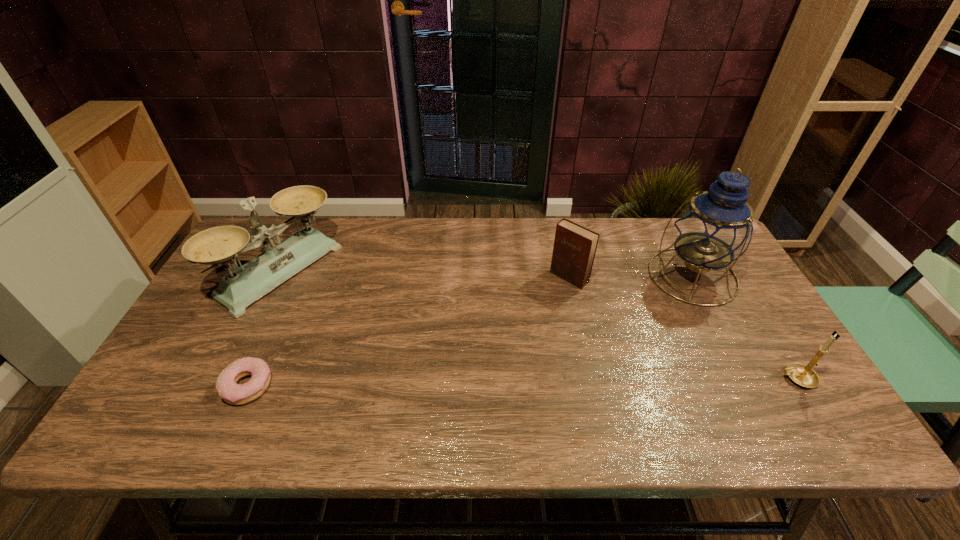
This screenshot has width=960, height=540. What are the coordinates of `doughnut` in the screenshot? It's located at (226, 385).

Identify the location of candle holder. The height and width of the screenshot is (540, 960). (803, 375).

The image size is (960, 540). Identify the location of diary. (574, 249).

You are a GUI agent. You are given a task and a screenshot of the screen. Output one action in this format:
    pyautogui.click(x=<x>, y=<y>)
    Task: Click on the tallest object
    The image size is (960, 540).
    Given the screenshot: What is the action you would take?
    pyautogui.click(x=716, y=227)

At what (x,y) coordinates should I click in order to perform the action: click on scale. Please return your answer as a coordinate pair (x, y). Looking at the image, I should click on (237, 290).

Find the location of a particular element. vacant space located on the back of the doughnut is located at coordinates (290, 288).

Find the location of a particular element. This screenshot has height=540, width=960. vacant space located on the handle side of the candle holder is located at coordinates (749, 378).

The width and height of the screenshot is (960, 540). What are the coordinates of `vacant space positioned on the handle side of the candle holder` in the screenshot? It's located at (695, 378).

You are a GUI agent. You are given a task and a screenshot of the screen. Output one action in this format:
    pyautogui.click(x=<x>, y=<y>)
    Task: Click on the free location located on the handle side of the candle holder
    The width and height of the screenshot is (960, 540).
    Given the screenshot: What is the action you would take?
    pyautogui.click(x=749, y=378)

You are a GUI agent. You are given a task and a screenshot of the screen. Output one action in this format:
    pyautogui.click(x=<x>, y=<y>)
    Task: Click on the free location located 0.370m on the front cover of the diary
    Image resolution: width=960 pixels, height=540 pixels.
    Given the screenshot: What is the action you would take?
    pyautogui.click(x=474, y=364)